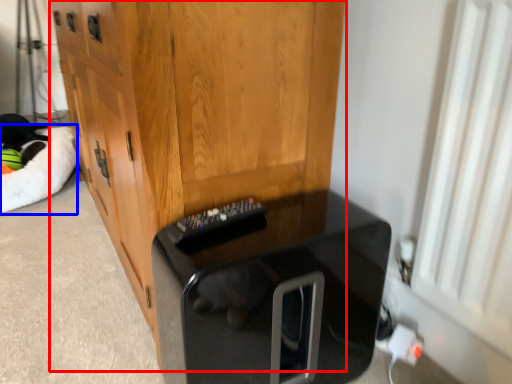
Question: Among these objects, which one is farthest to the camera, cabinetry (highlighted by a red box) or cat bed (highlighted by a blue box)?

Choices:
 (A) cabinetry
 (B) cat bed

Answer: (B)